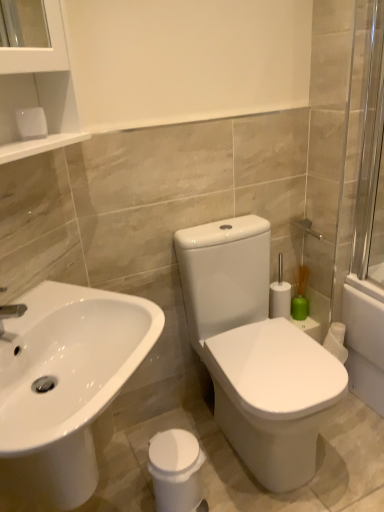
Question: Can you confirm if green matte vase at right is positioned to the left of white glossy trash can at lower center?

Choices:
 (A) no
 (B) yes

Answer: (A)

Question: Is green matte vase at right beside white glossy trash can at lower center?

Choices:
 (A) no
 (B) yes

Answer: (A)

Question: Considering the relative sizes of green matte vase at right and white glossy trash can at lower center in the image provided, is green matte vase at right bigger than white glossy trash can at lower center?

Choices:
 (A) no
 (B) yes

Answer: (A)

Question: Considering the relative sizes of green matte vase at right and white glossy trash can at lower center in the image provided, is green matte vase at right smaller than white glossy trash can at lower center?

Choices:
 (A) no
 (B) yes

Answer: (B)

Question: From a real-world perspective, is green matte vase at right located higher than white glossy trash can at lower center?

Choices:
 (A) no
 (B) yes

Answer: (B)

Question: From a real-world perspective, is green matte vase at right above or below transparent glass screen door at right?

Choices:
 (A) above
 (B) below

Answer: (B)

Question: Considering the positions of point (299, 297) and point (367, 144), is point (299, 297) closer or farther from the camera than point (367, 144)?

Choices:
 (A) closer
 (B) farther

Answer: (B)

Question: Considering their positions, is green matte vase at right located in front of or behind transparent glass screen door at right?

Choices:
 (A) behind
 (B) front

Answer: (A)

Question: Which is correct: green matte vase at right is inside transparent glass screen door at right, or outside of it?

Choices:
 (A) outside
 (B) inside

Answer: (A)

Question: Looking at their shapes, would you say silver metallic tap at left is wider or thinner than green matte vase at right?

Choices:
 (A) wide
 (B) thin

Answer: (A)

Question: Which is correct: silver metallic tap at left is inside green matte vase at right, or outside of it?

Choices:
 (A) inside
 (B) outside

Answer: (B)

Question: From their relative heights in the image, would you say silver metallic tap at left is taller or shorter than green matte vase at right?

Choices:
 (A) tall
 (B) short

Answer: (B)

Question: From the image's perspective, is silver metallic tap at left above or below green matte vase at right?

Choices:
 (A) above
 (B) below

Answer: (A)

Question: From the image's perspective, relative to silver metallic tap at left, is white glossy sink at lower left above or below?

Choices:
 (A) above
 (B) below

Answer: (B)

Question: From a real-world perspective, is white glossy sink at lower left above or below silver metallic tap at left?

Choices:
 (A) above
 (B) below

Answer: (B)